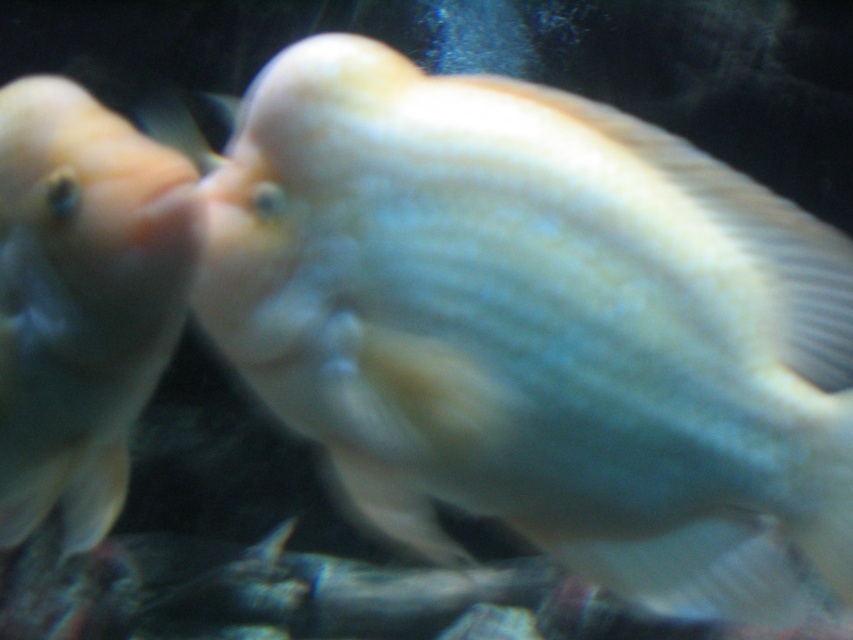
Question: Can you confirm if smooth white fish at center is positioned to the left of matte white fish at left?

Choices:
 (A) yes
 (B) no

Answer: (B)

Question: Which point is closer to the camera?

Choices:
 (A) (654, 266)
 (B) (100, 477)

Answer: (A)

Question: Can you confirm if smooth white fish at center is bigger than matte white fish at left?

Choices:
 (A) yes
 (B) no

Answer: (A)

Question: Is smooth white fish at center wider than matte white fish at left?

Choices:
 (A) no
 (B) yes

Answer: (B)

Question: Which of the following is the closest to the observer?

Choices:
 (A) matte white fish at left
 (B) smooth white fish at center

Answer: (B)